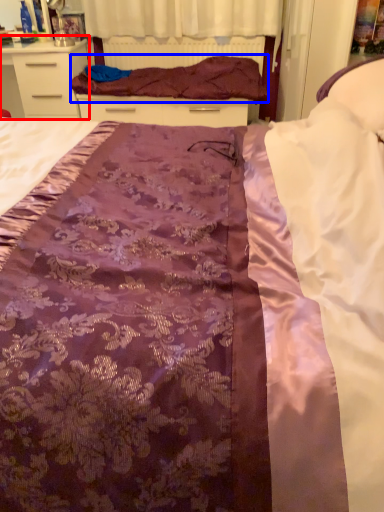
Question: Which point is closer to the camera, chest of drawers (highlighted by a red box) or blanket (highlighted by a blue box)?

Choices:
 (A) chest of drawers
 (B) blanket

Answer: (B)